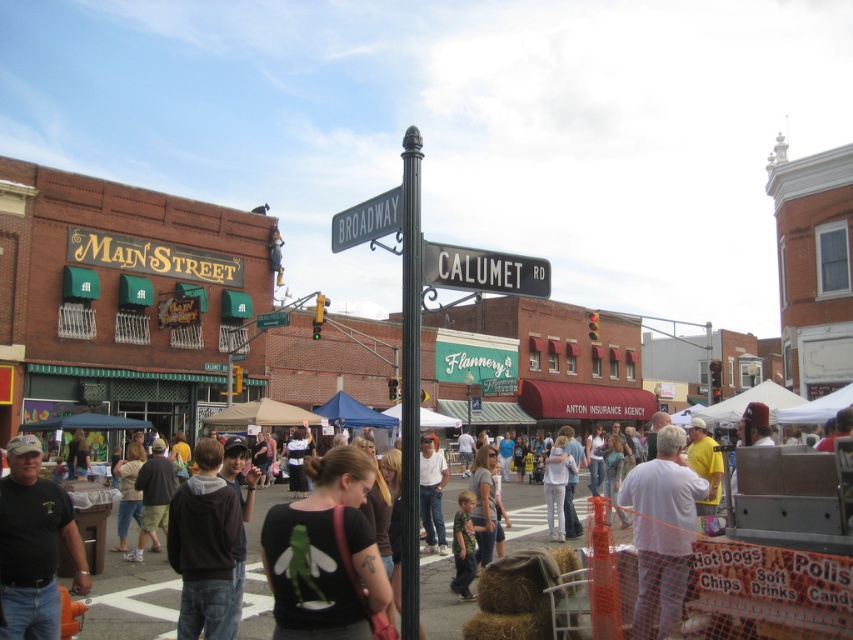
Is black t-shirt at lower left taller than black metal pole at center?

Incorrect, black t-shirt at lower left's height is not larger of black metal pole at center's.

What do you see at coordinates (33, 545) in the screenshot? The image size is (853, 640). I see `black t-shirt at lower left` at bounding box center [33, 545].

Is point (32, 513) positioned after point (412, 616)?

Yes, it is.

Locate an element on the screen. This screenshot has height=640, width=853. black t-shirt at lower left is located at coordinates (33, 545).

Which is more to the left, dark gray hoodie at center or black metal street sign at center?

From the viewer's perspective, dark gray hoodie at center appears more on the left side.

Can you confirm if dark gray hoodie at center is positioned below black metal street sign at center?

Correct, dark gray hoodie at center is located below black metal street sign at center.

Does point (177, 528) come in front of point (430, 280)?

No, (177, 528) is behind (430, 280).

Find the location of a particular element. This screenshot has width=853, height=640. dark gray hoodie at center is located at coordinates (206, 547).

Between black t-shirt at lower left and green plastic street sign at upper center, which one is positioned lower?

Positioned lower is black t-shirt at lower left.

Is point (49, 628) positioned behind point (257, 317)?

No, (49, 628) is in front of (257, 317).

This screenshot has width=853, height=640. What are the coordinates of `black t-shirt at lower left` in the screenshot? It's located at (33, 545).

Locate an element on the screen. The height and width of the screenshot is (640, 853). black t-shirt at lower left is located at coordinates (33, 545).